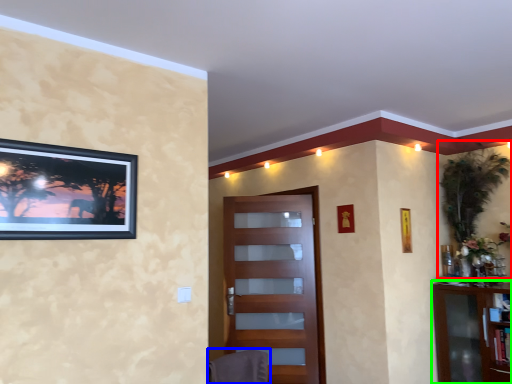
Question: Which object is the closest to the plant (highlighted by a red box)? Choose among these: swivel chair (highlighted by a blue box) or cabinetry (highlighted by a green box).

Choices:
 (A) swivel chair
 (B) cabinetry

Answer: (B)